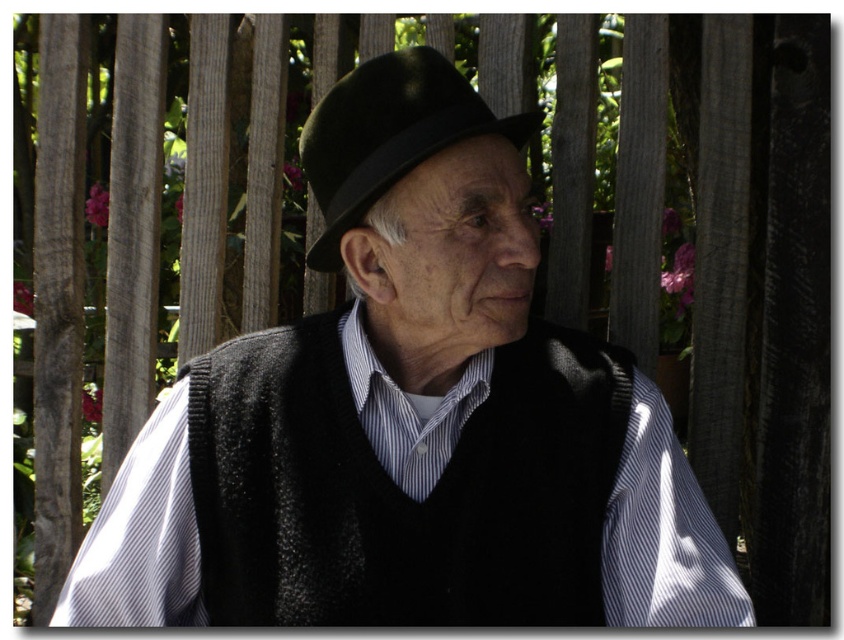
You are an artist sketching the elderly man in the scene. You need to decide which item, the black knitted vest at center or the black felt fedora at center, you should draw first to ensure proper proportions. Which one should you start with?

You should start drawing the black knitted vest at center first because it has a greater height compared to the black felt fedora at center, ensuring proper proportions.

The elderly man in the scene is wearing a black felt fedora at center and has a white striped fabric at center nearby. Which item is taller?

The black felt fedora at center is much taller than the white striped fabric at center.